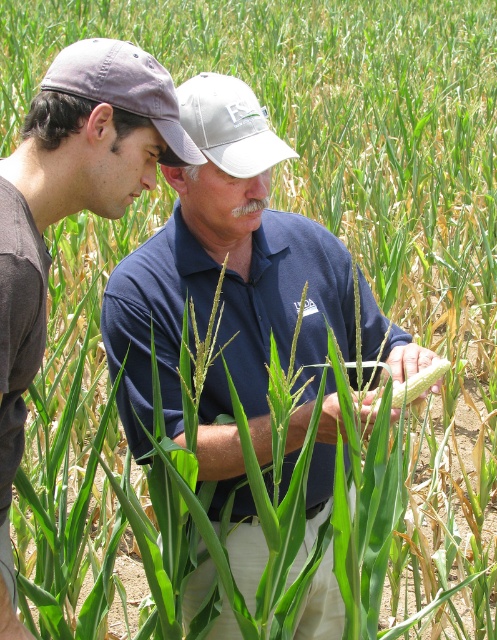
You are a farmer standing at point (189, 147). You need to reach the corn field inspection area which is 1.5 meters away. Can you reach it without moving?

The distance between you and the corn field inspection area is 1.46 meters, which is less than 1.5 meters, so yes, you can reach it without moving.

You are a farmer inspecting corn in a field. You notice a blue cotton shirt at center and a yellow matte corn at center. Which object is located to the left of the other?

The blue cotton shirt at center is positioned on the left side of yellow matte corn at center, so the blue cotton shirt at center is to the left of the yellow matte corn at center.

You are a farmer checking the corn field. You notice the blue cotton shirt at center and the yellow matte corn at center. Which object is taller?

The blue cotton shirt at center is taller than the yellow matte corn at center.